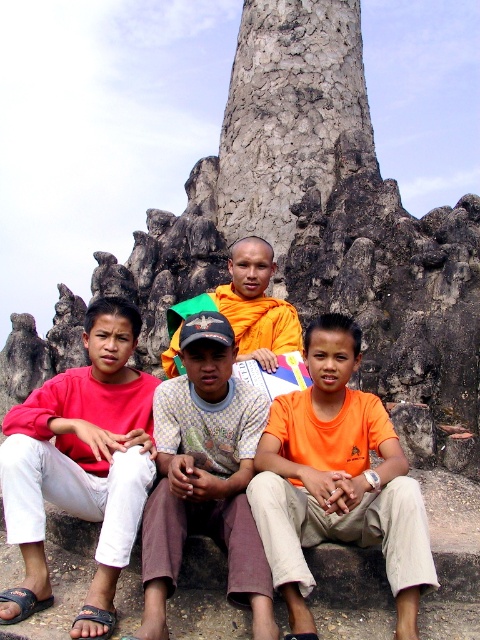
Question: Does matte red shirt at left lie in front of orange cloth at center?

Choices:
 (A) no
 (B) yes

Answer: (B)

Question: Does orange cotton shirt at center appear over matte red shirt at left?

Choices:
 (A) no
 (B) yes

Answer: (A)

Question: Based on their relative distances, which object is farther from the light brown cotton shirt at center?

Choices:
 (A) matte red shirt at left
 (B) orange cotton shirt at center
 (C) orange cloth at center

Answer: (C)

Question: Considering the relative positions of light brown cotton shirt at center and orange cloth at center in the image provided, where is light brown cotton shirt at center located with respect to orange cloth at center?

Choices:
 (A) right
 (B) left

Answer: (B)

Question: Which of the following is the closest to the observer?

Choices:
 (A) orange cotton shirt at center
 (B) light brown cotton shirt at center
 (C) matte red shirt at left
 (D) orange cloth at center

Answer: (B)

Question: Which point appears closest to the camera in this image?

Choices:
 (A) (336, 476)
 (B) (269, 630)
 (C) (45, 419)

Answer: (B)